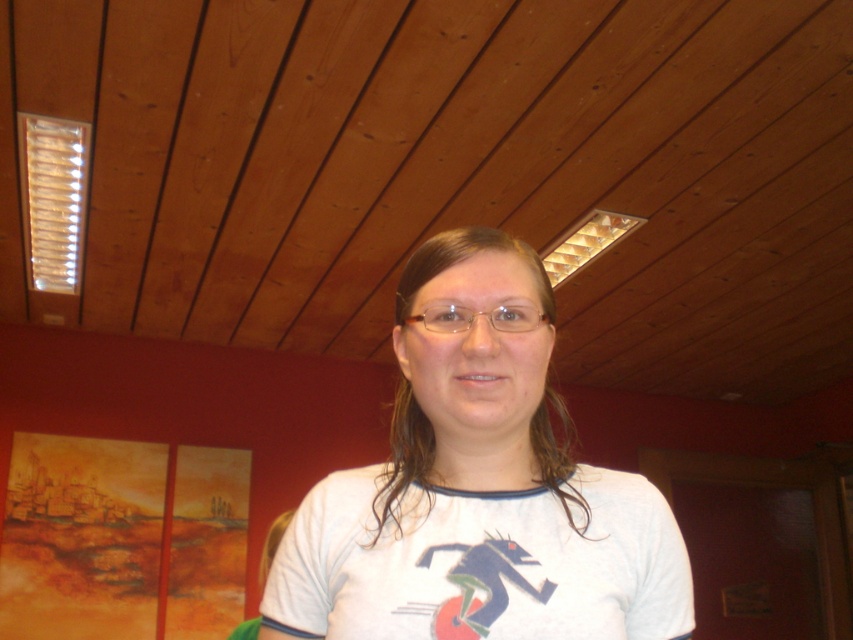
Does point (363, 566) come in front of point (473, 310)?

That is False.

Does white cotton t-shirt at center appear on the right side of clear plastic glasses at center?

In fact, white cotton t-shirt at center is to the left of clear plastic glasses at center.

The image size is (853, 640). What do you see at coordinates (479, 492) in the screenshot?
I see `white cotton t-shirt at center` at bounding box center [479, 492].

The height and width of the screenshot is (640, 853). Find the location of `white cotton t-shirt at center`. white cotton t-shirt at center is located at coordinates (479, 492).